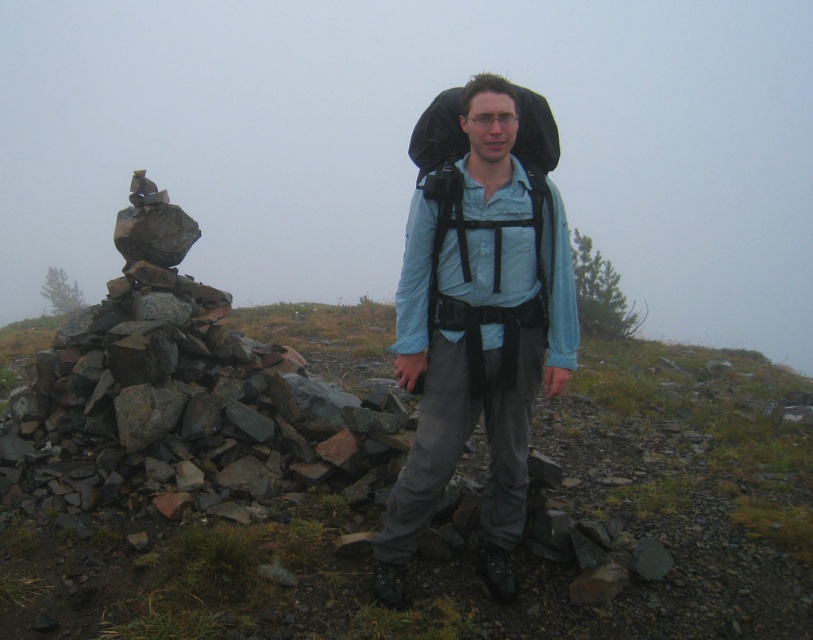
This screenshot has width=813, height=640. Describe the element at coordinates (477, 332) in the screenshot. I see `matte black backpack at center` at that location.

Between matte black backpack at center and black fabric backpack at center, which one is positioned higher?

black fabric backpack at center

Between point (520, 467) and point (459, 148), which one is positioned in front?

Positioned in front is point (459, 148).

What are the coordinates of `matte black backpack at center` in the screenshot? It's located at (477, 332).